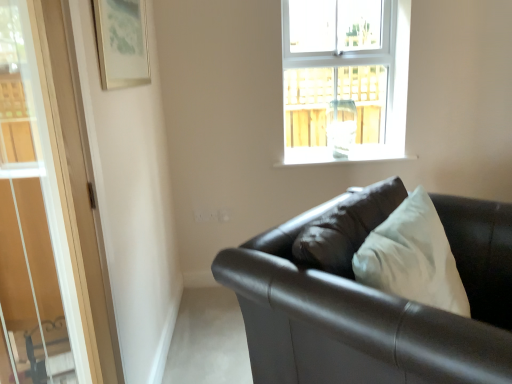
This screenshot has height=384, width=512. What do you see at coordinates (375, 308) in the screenshot?
I see `matte black couch at lower right` at bounding box center [375, 308].

The image size is (512, 384). What do you see at coordinates (344, 79) in the screenshot?
I see `clear glass window at upper center` at bounding box center [344, 79].

At what (x,y) coordinates should I click in order to perform the action: click on white smooth window sill at upper center. Please return your answer as a coordinate pair (x, y). Image resolution: width=512 pixels, height=384 pixels. Looking at the image, I should click on (341, 158).

Measure the distance between point (23,300) and camera.

The depth of point (23,300) is 1.75 meters.

The image size is (512, 384). I want to click on matte black couch at lower right, so click(x=375, y=308).

Considering the relative sizes of metallic silver picture frame at upper left and clear glass window at upper center in the image provided, is metallic silver picture frame at upper left bigger than clear glass window at upper center?

Actually, metallic silver picture frame at upper left might be smaller than clear glass window at upper center.

Is metallic silver picture frame at upper left not inside clear glass window at upper center?

Yes, metallic silver picture frame at upper left is not within clear glass window at upper center.

I want to click on window located behind the metallic silver picture frame at upper left, so click(344, 79).

How different are the orientations of metallic silver picture frame at upper left and clear glass window at upper center in degrees?

87.3 degrees separate the facing orientations of metallic silver picture frame at upper left and clear glass window at upper center.

Is white smooth window sill at upper center turned away from transparent glass door at left?

white smooth window sill at upper center is not turned away from transparent glass door at left.

Considering the relative sizes of white smooth window sill at upper center and transparent glass door at left in the image provided, is white smooth window sill at upper center thinner than transparent glass door at left?

No.

How different are the orientations of white smooth window sill at upper center and transparent glass door at left in degrees?

There is a 89.9-degree angle between the facing directions of white smooth window sill at upper center and transparent glass door at left.

Is white smooth window sill at upper center far from transparent glass door at left?

Yes, white smooth window sill at upper center is far from transparent glass door at left.

Which of these two, white smooth window sill at upper center or clear glass window at upper center, stands shorter?

white smooth window sill at upper center is shorter.

Is white smooth window sill at upper center bigger or smaller than clear glass window at upper center?

Clearly, white smooth window sill at upper center is smaller in size than clear glass window at upper center.

From the image's perspective, which one is positioned higher, white smooth window sill at upper center or clear glass window at upper center?

From the image's view, clear glass window at upper center is above.

In the image, is metallic silver picture frame at upper left on the left side or the right side of white smooth window sill at upper center?

Clearly, metallic silver picture frame at upper left is on the left of white smooth window sill at upper center in the image.

Looking at this image, considering their positions, is metallic silver picture frame at upper left located in front of or behind white smooth window sill at upper center?

Clearly, metallic silver picture frame at upper left is in front of white smooth window sill at upper center.

This screenshot has height=384, width=512. What are the coordinates of `window sill behind the metallic silver picture frame at upper left` in the screenshot? It's located at [x=341, y=158].

Considering the relative sizes of metallic silver picture frame at upper left and white smooth window sill at upper center in the image provided, is metallic silver picture frame at upper left taller than white smooth window sill at upper center?

Yes, metallic silver picture frame at upper left is taller than white smooth window sill at upper center.

From the image's perspective, is metallic silver picture frame at upper left above or below transparent glass door at left?

Clearly, from the image's perspective, metallic silver picture frame at upper left is above transparent glass door at left.

Is metallic silver picture frame at upper left positioned beyond the bounds of transparent glass door at left?

Absolutely, metallic silver picture frame at upper left is external to transparent glass door at left.

Is metallic silver picture frame at upper left further to camera compared to transparent glass door at left?

Yes.

This screenshot has width=512, height=384. What are the coordinates of `glass door below the metallic silver picture frame at upper left (from the image's perspective)` in the screenshot? It's located at (32, 225).

Looking at this image, which of these two, transparent glass door at left or white smooth window sill at upper center, is smaller?

white smooth window sill at upper center is smaller.

This screenshot has width=512, height=384. I want to click on glass door in front of the white smooth window sill at upper center, so pyautogui.click(x=32, y=225).

Between transparent glass door at left and white smooth window sill at upper center, which one has smaller width?

With smaller width is transparent glass door at left.

In the image, is transparent glass door at left positioned in front of or behind white smooth window sill at upper center?

transparent glass door at left is in front of white smooth window sill at upper center.

Consider the image. From the image's perspective, is metallic silver picture frame at upper left located above or below matte black couch at lower right?

From the image's perspective, metallic silver picture frame at upper left appears above matte black couch at lower right.

Locate an element on the screen. This screenshot has height=384, width=512. studio couch on the right of metallic silver picture frame at upper left is located at coordinates (375, 308).

Which is behind, point (145, 42) or point (331, 284)?

The point (145, 42) is more distant.

Between metallic silver picture frame at upper left and matte black couch at lower right, which one has less height?

With less height is metallic silver picture frame at upper left.

Locate an element on the screen. window above the metallic silver picture frame at upper left (from the image's perspective) is located at coordinates point(344,79).

Image resolution: width=512 pixels, height=384 pixels. In order to click on window sill below the transparent glass door at left (from a real-world perspective) in this screenshot , I will do `click(341, 158)`.

Based on their spatial positions, is matte black couch at lower right or clear glass window at upper center further from metallic silver picture frame at upper left?

clear glass window at upper center.

Which object lies nearer to the anchor point metallic silver picture frame at upper left, transparent glass door at left or clear glass window at upper center?

Among the two, transparent glass door at left is located nearer to metallic silver picture frame at upper left.

In the scene shown: When comparing their distances from white smooth window sill at upper center, does matte black couch at lower right or metallic silver picture frame at upper left seem closer?

metallic silver picture frame at upper left is positioned closer to the anchor white smooth window sill at upper center.

When comparing their distances from metallic silver picture frame at upper left, does clear glass window at upper center or transparent glass door at left seem closer?

The object closer to metallic silver picture frame at upper left is transparent glass door at left.

Consider the image. When comparing their distances from matte black couch at lower right, does metallic silver picture frame at upper left or transparent glass door at left seem further?

Among the two, metallic silver picture frame at upper left is located further to matte black couch at lower right.

Which object lies nearer to the anchor point white smooth window sill at upper center, transparent glass door at left or metallic silver picture frame at upper left?

Based on the image, metallic silver picture frame at upper left appears to be nearer to white smooth window sill at upper center.

When comparing their distances from clear glass window at upper center, does matte black couch at lower right or transparent glass door at left seem closer?

Based on the image, transparent glass door at left appears to be nearer to clear glass window at upper center.

Looking at the image, which one is located further to clear glass window at upper center, matte black couch at lower right or metallic silver picture frame at upper left?

matte black couch at lower right lies further to clear glass window at upper center than the other object.

Locate an element on the screen. glass door that lies between metallic silver picture frame at upper left and matte black couch at lower right from top to bottom is located at coordinates (32, 225).

Find the location of `studio couch located between transparent glass door at left and clear glass window at upper center in the depth direction`. studio couch located between transparent glass door at left and clear glass window at upper center in the depth direction is located at coordinates (375, 308).

In order to click on window between metallic silver picture frame at upper left and white smooth window sill at upper center from front to back in this screenshot , I will do `click(344, 79)`.

I want to click on studio couch between transparent glass door at left and white smooth window sill at upper center in the front-back direction, so click(x=375, y=308).